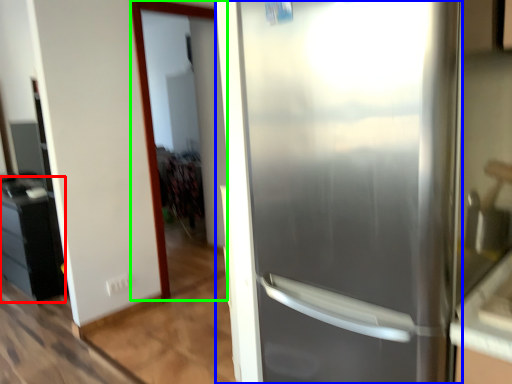
Question: Which object is positioned farthest from cabinetry (highlighted by a red box)? Select from refrigerator (highlighted by a blue box) and screen door (highlighted by a green box).

Choices:
 (A) refrigerator
 (B) screen door

Answer: (A)